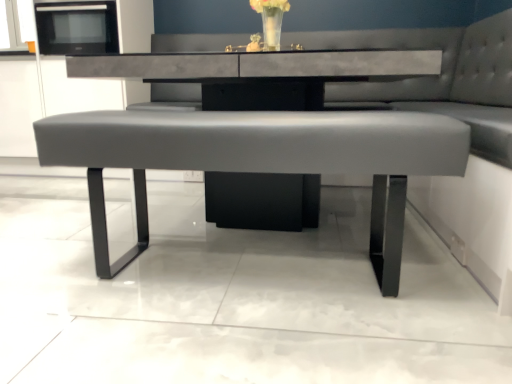
Where is `matte gray bench at center`? This screenshot has height=384, width=512. matte gray bench at center is located at coordinates (259, 159).

Locate an element on the screen. This screenshot has width=512, height=384. translucent glass vase at upper center is located at coordinates (271, 19).

What are the coordinates of `black matte microwave at upper left` in the screenshot? It's located at (77, 27).

Is black matte microwave at upper left further to the viewer compared to translucent glass vase at upper center?

Yes, it is.

This screenshot has width=512, height=384. Find the location of `floral arrangement below the black matte microwave at upper left (from a real-world perspective)`. floral arrangement below the black matte microwave at upper left (from a real-world perspective) is located at coordinates (271, 19).

Is the surface of black matte microwave at upper left in direct contact with translucent glass vase at upper center?

There is a gap between black matte microwave at upper left and translucent glass vase at upper center.

Is black matte microwave at upper left facing towards translucent glass vase at upper center?

No, black matte microwave at upper left does not turn towards translucent glass vase at upper center.

Who is bigger, matte gray bench at center or black matte microwave at upper left?

With larger size is matte gray bench at center.

Considering their positions, is matte gray bench at center located in front of or behind black matte microwave at upper left?

Clearly, matte gray bench at center is in front of black matte microwave at upper left.

The image size is (512, 384). What are the coordinates of `appliance behind the matte gray bench at center` in the screenshot? It's located at (77, 27).

Between matte gray bench at center and matte gray bench at center, which one has more height?

With more height is matte gray bench at center.

From a real-world perspective, relative to matte gray bench at center, is matte gray bench at center vertically above or below?

Clearly, from a real-world perspective, matte gray bench at center is above matte gray bench at center.

Is matte gray bench at center surrounded by matte gray bench at center?

Absolutely, matte gray bench at center is inside matte gray bench at center.

In the image, is matte gray bench at center on the left side or the right side of matte gray bench at center?

matte gray bench at center is to the right of matte gray bench at center.

From the image's perspective, does translucent glass vase at upper center appear higher than matte gray bench at center?

Yes, from the image's perspective, translucent glass vase at upper center is over matte gray bench at center.

Is translucent glass vase at upper center with matte gray bench at center?

translucent glass vase at upper center is not next to matte gray bench at center, and they're not touching.

Where is `floral arrangement behind the matte gray bench at center`? Image resolution: width=512 pixels, height=384 pixels. floral arrangement behind the matte gray bench at center is located at coordinates (271, 19).

Considering the sizes of translucent glass vase at upper center and matte gray bench at center in the image, is translucent glass vase at upper center wider or thinner than matte gray bench at center?

translucent glass vase at upper center is thinner than matte gray bench at center.

Would you say translucent glass vase at upper center is to the left or to the right of black matte microwave at upper left in the picture?

From the image, it's evident that translucent glass vase at upper center is to the right of black matte microwave at upper left.

From a real-world perspective, between translucent glass vase at upper center and black matte microwave at upper left, who is vertically lower?

translucent glass vase at upper center, from a real-world perspective.

Between translucent glass vase at upper center and black matte microwave at upper left, which one has larger size?

Bigger between the two is black matte microwave at upper left.

Is black matte microwave at upper left at the right side of matte gray bench at center?

No, black matte microwave at upper left is not to the right of matte gray bench at center.

Which object is closer to the camera, black matte microwave at upper left or matte gray bench at center?

matte gray bench at center.

Image resolution: width=512 pixels, height=384 pixels. Identify the location of round table that appears in front of the black matte microwave at upper left. (262, 74).

Looking at the image, does black matte microwave at upper left seem bigger or smaller compared to matte gray bench at center?

In the image, black matte microwave at upper left appears to be smaller than matte gray bench at center.

Consider the image. From the image's perspective, which one is positioned higher, matte gray bench at center or translucent glass vase at upper center?

translucent glass vase at upper center appears higher in the image.

Is matte gray bench at center oriented towards translucent glass vase at upper center?

No, matte gray bench at center is not aimed at translucent glass vase at upper center.

Consider the image. Which object is thinner, matte gray bench at center or translucent glass vase at upper center?

translucent glass vase at upper center is thinner.

Choose the correct answer: Is matte gray bench at center inside translucent glass vase at upper center or outside it?

matte gray bench at center exists outside the volume of translucent glass vase at upper center.

I want to click on floral arrangement in front of the black matte microwave at upper left, so click(x=271, y=19).

Locate an element on the screen. The image size is (512, 384). round table on the right of black matte microwave at upper left is located at coordinates (262, 74).

Looking at the image, which one is located closer to black matte microwave at upper left, matte gray bench at center or translucent glass vase at upper center?

translucent glass vase at upper center lies closer to black matte microwave at upper left than the other object.

Considering their positions, is black matte microwave at upper left positioned further to matte gray bench at center than matte gray bench at center?

Based on the image, black matte microwave at upper left appears to be further to matte gray bench at center.

Which object lies nearer to the anchor point translucent glass vase at upper center, matte gray bench at center or matte gray bench at center?

matte gray bench at center.

Estimate the real-world distances between objects in this image. Which object is further from translucent glass vase at upper center, matte gray bench at center or matte gray bench at center?

Among the two, matte gray bench at center is located further to translucent glass vase at upper center.

In the scene shown: Based on their spatial positions, is black matte microwave at upper left or matte gray bench at center closer to matte gray bench at center?

Among the two, matte gray bench at center is located nearer to matte gray bench at center.

Considering their positions, is black matte microwave at upper left positioned closer to matte gray bench at center than translucent glass vase at upper center?

translucent glass vase at upper center lies closer to matte gray bench at center than the other object.

Considering their positions, is matte gray bench at center positioned closer to black matte microwave at upper left than matte gray bench at center?

matte gray bench at center lies closer to black matte microwave at upper left than the other object.

Considering their positions, is translucent glass vase at upper center positioned further to matte gray bench at center than black matte microwave at upper left?

Among the two, black matte microwave at upper left is located further to matte gray bench at center.

I want to click on floral arrangement between black matte microwave at upper left and matte gray bench at center from left to right, so click(x=271, y=19).

Locate an element on the screen. The height and width of the screenshot is (384, 512). round table between translucent glass vase at upper center and matte gray bench at center vertically is located at coordinates (262, 74).

Identify the location of floral arrangement between matte gray bench at center and black matte microwave at upper left from front to back. Image resolution: width=512 pixels, height=384 pixels. (271, 19).

At what (x,y) coordinates should I click in order to perform the action: click on round table between matte gray bench at center and black matte microwave at upper left in the front-back direction. Please return your answer as a coordinate pair (x, y). Looking at the image, I should click on (262, 74).